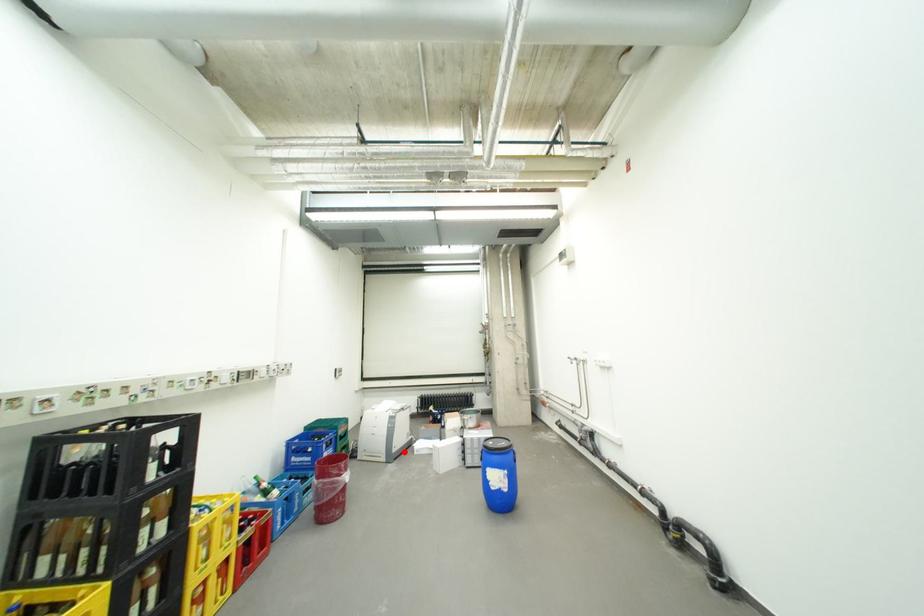
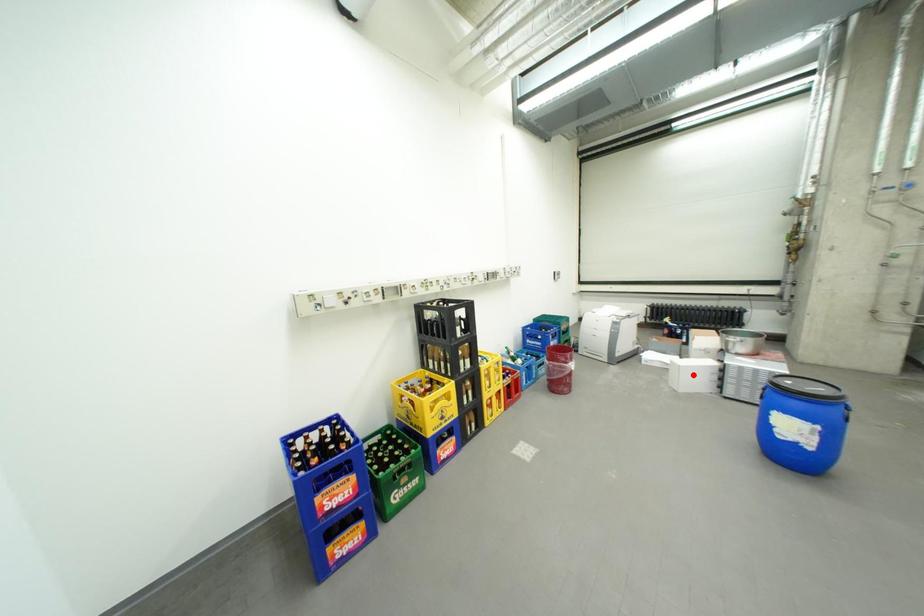
I am providing you with two images of the same scene from different viewpoints. A red point is marked on the first image and another point is marked on the second image. Are the points marked in image1 and image2 representing the same 3D position?

No